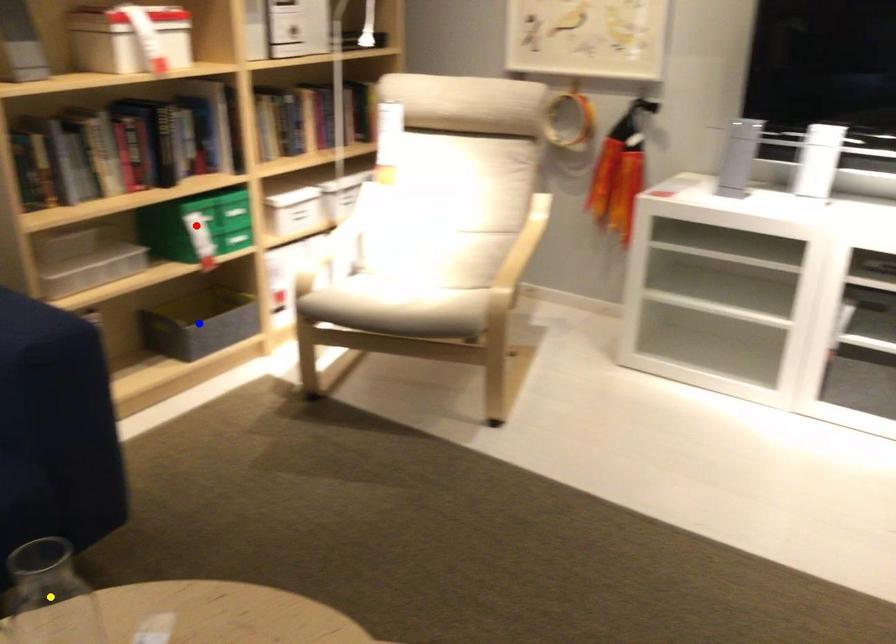
Order these from nearest to farthest:
blue point
yellow point
red point

yellow point, red point, blue point